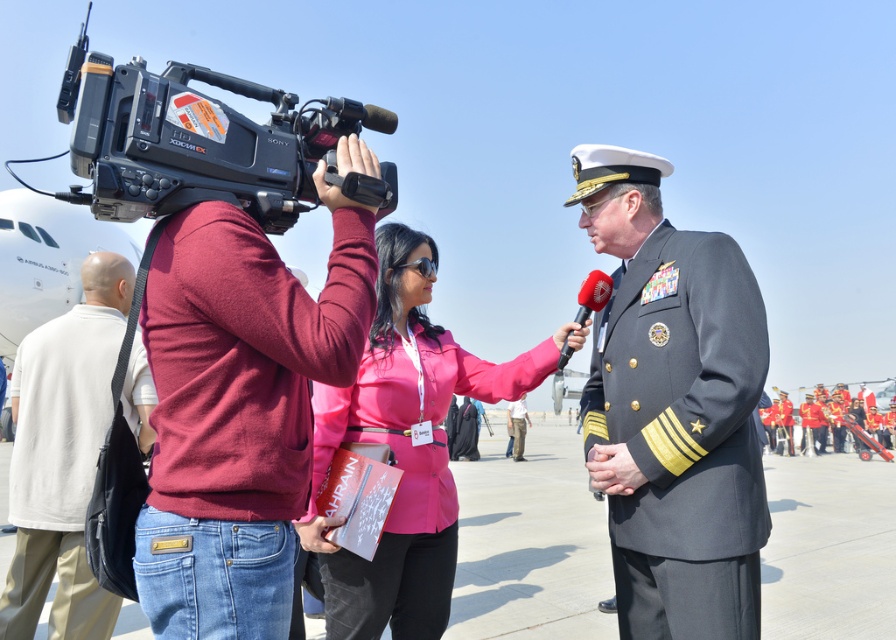
Question: Which point is farther from the camera taking this photo?

Choices:
 (A) (369, 355)
 (B) (717, 497)
 (C) (82, 536)

Answer: (C)

Question: Can you confirm if pink fabric shirt at center is positioned to the left of dark blue fabric uniform at center?

Choices:
 (A) no
 (B) yes

Answer: (B)

Question: Which object is the farthest from the dark blue fabric uniform at center?

Choices:
 (A) maroon sweater at center
 (B) dark gray wool military uniform at center
 (C) pink fabric shirt at center

Answer: (A)

Question: Is pink fabric shirt at center to the right of dark blue fabric uniform at center from the viewer's perspective?

Choices:
 (A) yes
 (B) no

Answer: (B)

Question: Is black plastic video camera at upper left to the left of light gray cotton shirt at left from the viewer's perspective?

Choices:
 (A) yes
 (B) no

Answer: (B)

Question: Considering the real-world distances, which object is closest to the pink fabric shirt at center?

Choices:
 (A) dark blue fabric uniform at center
 (B) maroon sweater at center
 (C) dark gray wool military uniform at center

Answer: (B)